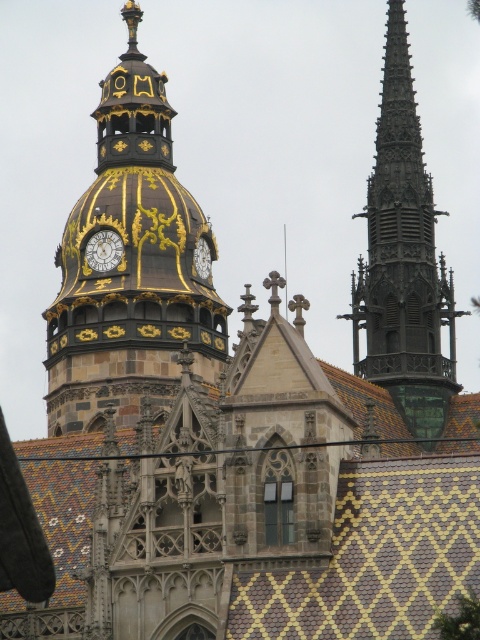
Can you confirm if gold metallic clock at center is wider than goldmetallicclock tower at upper center?

Correct, the width of gold metallic clock at center exceeds that of goldmetallicclock tower at upper center.

How far apart are gold metallic clock at center and goldmetallicclock tower at upper center?

They are 5.15 meters apart.

Does point (119, 257) come closer to viewer compared to point (210, 259)?

Yes, it is in front of point (210, 259).

You are a GUI agent. You are given a task and a screenshot of the screen. Output one action in this format:
    pyautogui.click(x=<x>, y=<y>)
    Task: Click on the gold metallic clock at center
    
    Given the screenshot: What is the action you would take?
    [x=104, y=250]

Is point (168, 179) positioned before point (423, 292)?

No.

Can you confirm if goldmaterial/textureclock tower at upper center is smaller than smooth gray steeple at right?

No, goldmaterial/textureclock tower at upper center is not smaller than smooth gray steeple at right.

Which is in front, point (68, 289) or point (391, 333)?

Point (391, 333) is in front.

The width and height of the screenshot is (480, 640). What are the coordinates of `goldmaterial/textureclock tower at upper center` in the screenshot? It's located at (131, 264).

Is smooth gray steeple at right shorter than goldmetallicclock tower at upper center?

No, smooth gray steeple at right is not shorter than goldmetallicclock tower at upper center.

What do you see at coordinates (404, 259) in the screenshot? This screenshot has width=480, height=640. I see `smooth gray steeple at right` at bounding box center [404, 259].

The image size is (480, 640). Identify the location of smooth gray steeple at right. (404, 259).